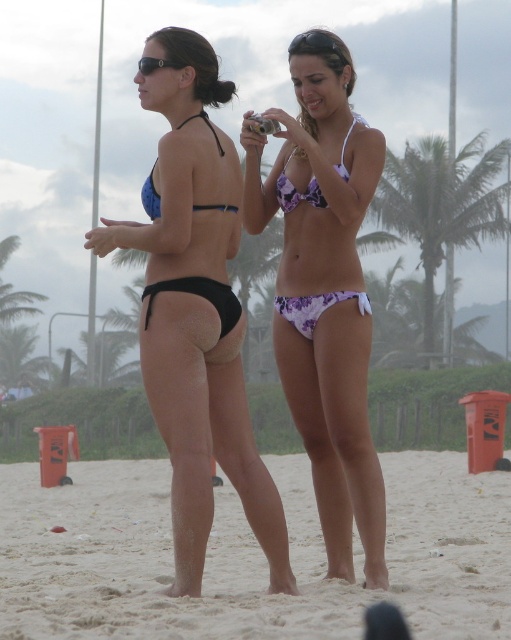
Is green leafy palm tree at upper center to the left of black plastic goggles at upper center from the viewer's perspective?

In fact, green leafy palm tree at upper center is to the right of black plastic goggles at upper center.

Is green leafy palm tree at upper center taller than black plastic goggles at upper center?

No, green leafy palm tree at upper center is not taller than black plastic goggles at upper center.

Which is behind, point (498, 152) or point (328, 42)?

Point (498, 152)

The height and width of the screenshot is (640, 511). Find the location of `green leafy palm tree at upper center`. green leafy palm tree at upper center is located at coordinates (442, 205).

Between purple floral bikini bottom at center and purple floral fabric bikini at center, which one has more height?

purple floral bikini bottom at center is taller.

At what (x,y) coordinates should I click in order to perform the action: click on purple floral bikini bottom at center. Please return your answer as a coordinate pair (x, y). This screenshot has height=640, width=511. Looking at the image, I should click on (324, 294).

Does black matte bikini bottom at center have a lesser width compared to black matte bikini at left?

No.

Measure the distance between black matte bikini bottom at center and black matte bikini at left.

The distance of black matte bikini bottom at center from black matte bikini at left is 67.08 centimeters.

Measure the distance between black matte bikini bottom at center and camera.

They are 20.08 feet apart.

I want to click on black matte bikini bottom at center, so click(x=196, y=310).